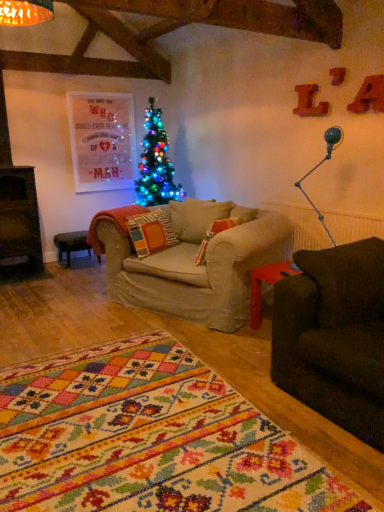
Question: Is the depth of black leather stool at lower left less than that of metallic blue lamp at right?

Choices:
 (A) no
 (B) yes

Answer: (A)

Question: Is black leather stool at lower left facing towards metallic blue lamp at right?

Choices:
 (A) no
 (B) yes

Answer: (B)

Question: Is black leather stool at lower left outside of metallic blue lamp at right?

Choices:
 (A) yes
 (B) no

Answer: (A)

Question: From a real-world perspective, is black leather stool at lower left under metallic blue lamp at right?

Choices:
 (A) no
 (B) yes

Answer: (B)

Question: Is black leather stool at lower left to the left of metallic blue lamp at right from the viewer's perspective?

Choices:
 (A) yes
 (B) no

Answer: (A)

Question: Is the surface of black leather stool at lower left in direct contact with metallic blue lamp at right?

Choices:
 (A) yes
 (B) no

Answer: (B)

Question: Can you confirm if metallic blue lamp at right is bigger than black leather stool at lower left?

Choices:
 (A) yes
 (B) no

Answer: (B)

Question: Is metallic blue lamp at right aimed at black leather stool at lower left?

Choices:
 (A) no
 (B) yes

Answer: (A)

Question: Can you confirm if metallic blue lamp at right is positioned to the right of black leather stool at lower left?

Choices:
 (A) no
 (B) yes

Answer: (B)

Question: From the image's perspective, is metallic blue lamp at right located above black leather stool at lower left?

Choices:
 (A) no
 (B) yes

Answer: (B)

Question: From the image's perspective, is metallic blue lamp at right under black leather stool at lower left?

Choices:
 (A) yes
 (B) no

Answer: (B)

Question: Does metallic blue lamp at right have a greater width compared to black leather stool at lower left?

Choices:
 (A) yes
 (B) no

Answer: (B)

Question: In terms of size, does black leather stool at lower left appear bigger or smaller than metallic blue lamp at right?

Choices:
 (A) small
 (B) big

Answer: (B)